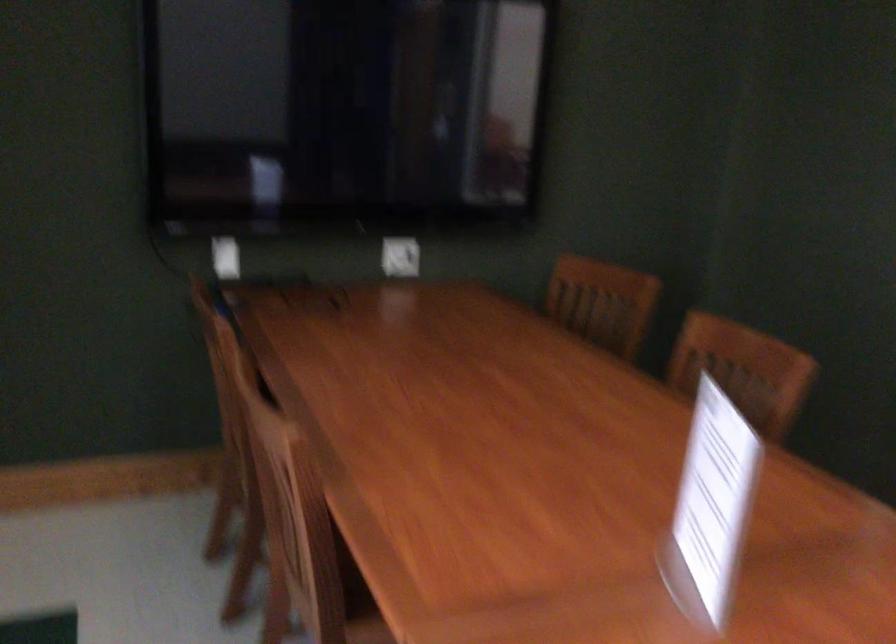
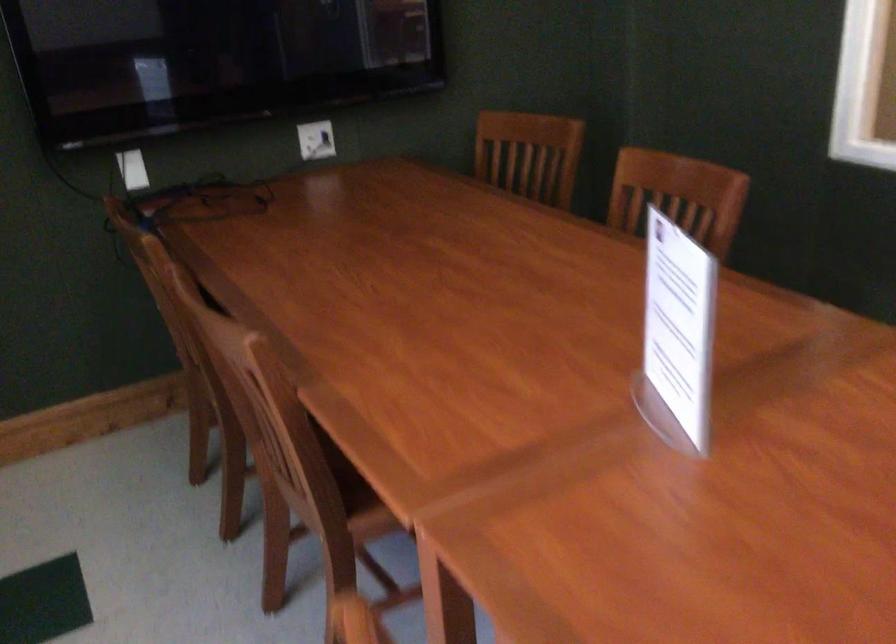
Find the pixel in the second image that matches pixel 714 509 in the first image.

(677, 335)